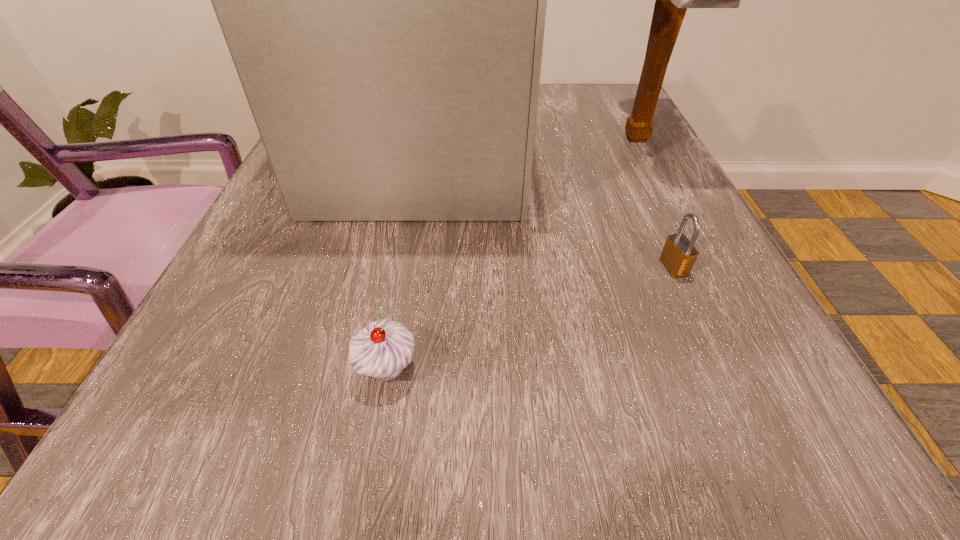
Where is `vacant space that is in between the mallet and the cupcake`? vacant space that is in between the mallet and the cupcake is located at coordinates (512, 254).

Where is `unoccupied position between the shortest object and the nearest object`? Image resolution: width=960 pixels, height=540 pixels. unoccupied position between the shortest object and the nearest object is located at coordinates click(x=531, y=318).

Locate which object is the third closest to the toaster oven. Please provide its 2D coordinates. Your answer should be formatted as a tuple, i.e. [(x, y)], where the tuple contains the x and y coordinates of a point satisfying the conditions above.

[(382, 349)]

Identify the location of object that is the second closest to the mallet. (679, 254).

Identify the location of free region that satisfies the following two spatial constraints: 1. on the front panel of the shortest object; 2. on the right side of the toaster oven. (411, 267).

Find the location of a particular element. free region that satisfies the following two spatial constraints: 1. on the back side of the mallet; 2. on the right side of the third farthest object is located at coordinates (616, 139).

You are a GUI agent. You are given a task and a screenshot of the screen. Output one action in this format:
    pyautogui.click(x=<x>, y=<y>)
    Task: Click on the vacant position in the image that satisfies the following two spatial constraints: 1. on the back side of the shortest object; 2. on the right side of the nearest object
    
    Given the screenshot: What is the action you would take?
    pyautogui.click(x=405, y=267)